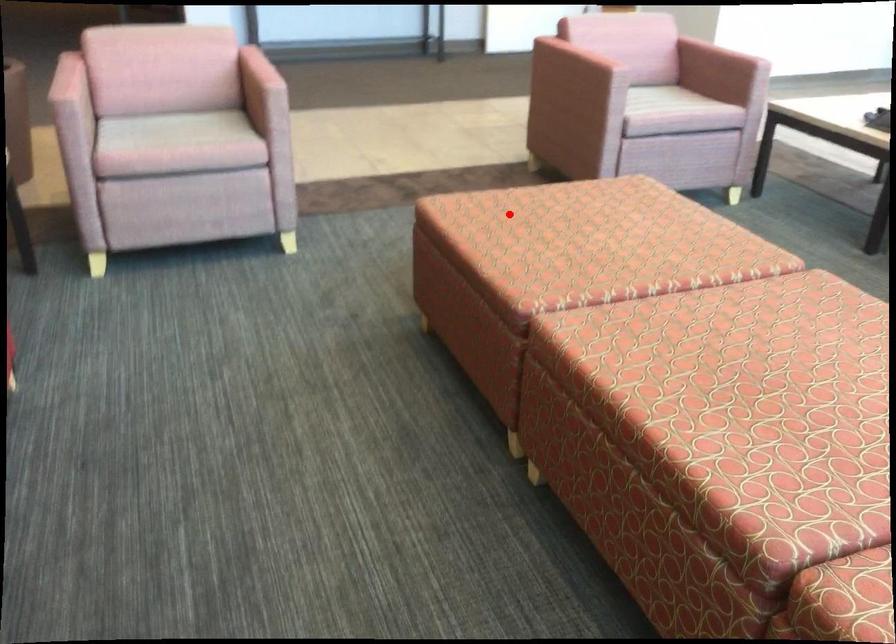
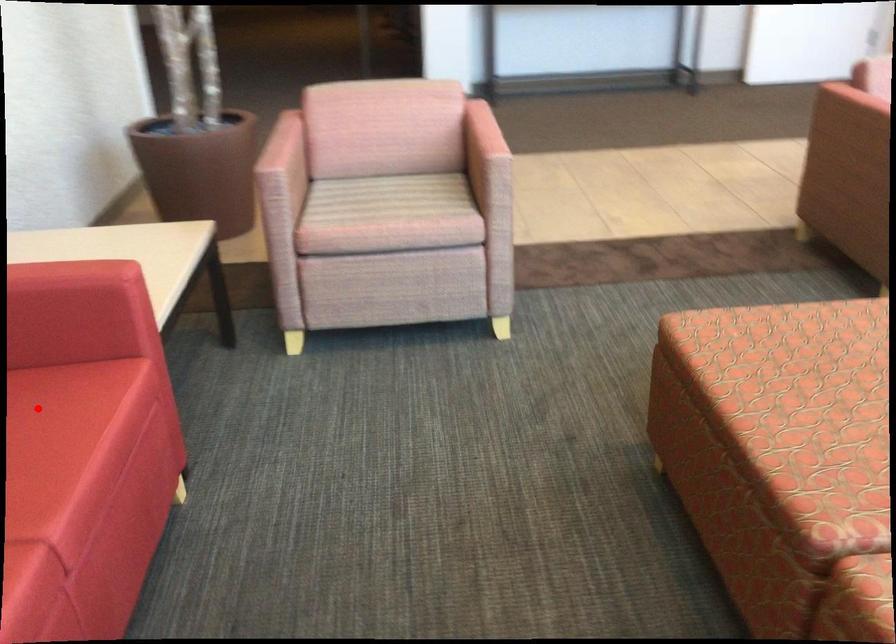
I am providing you with two images of the same scene from different viewpoints. A red point is marked on the first image and another point is marked on the second image. Do the highlighted points in image1 and image2 indicate the same real-world spot?

No